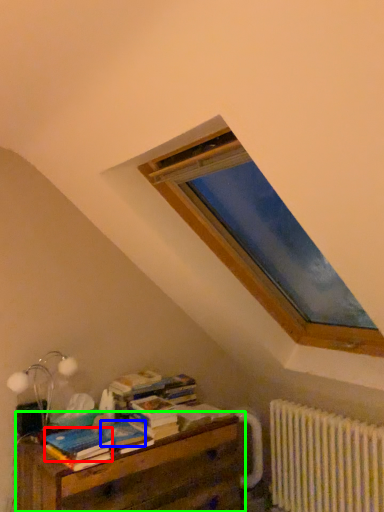
Question: Which object is positioned farthest from paperback book (highlighted by a red box)? Select from paperback book (highlighted by a blue box) and nightstand (highlighted by a green box).

Choices:
 (A) paperback book
 (B) nightstand

Answer: (B)